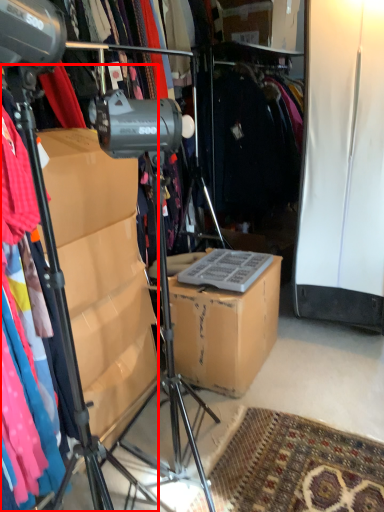
Question: From the image's perspective, what is the correct spatial relationship of tripod (annotated by the red box) in relation to cardboard box?

Choices:
 (A) below
 (B) above

Answer: (B)